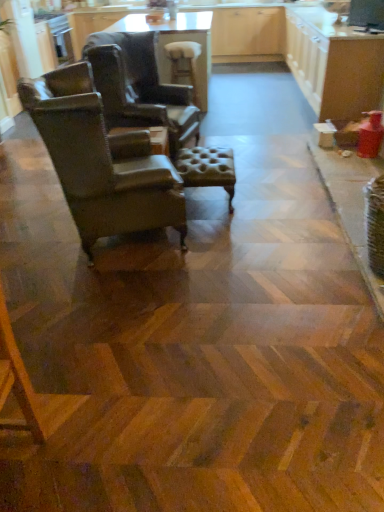
Question: Can you confirm if tufted leather ottoman at center, which ranks as the 1th bar stool in bottom-to-top order, is thinner than white glossy cabinets at upper right?

Choices:
 (A) yes
 (B) no

Answer: (A)

Question: From a real-world perspective, is tufted leather ottoman at center, which ranks as the 2th bar stool in back-to-front order, under white glossy cabinets at upper right?

Choices:
 (A) no
 (B) yes

Answer: (B)

Question: Is tufted leather ottoman at center, which ranks as the 1th bar stool in bottom-to-top order, positioned far away from white glossy cabinets at upper right?

Choices:
 (A) no
 (B) yes

Answer: (B)

Question: Is tufted leather ottoman at center, which ranks as the 2th bar stool in back-to-front order, directly adjacent to white glossy cabinets at upper right?

Choices:
 (A) no
 (B) yes

Answer: (A)

Question: Does tufted leather ottoman at center, which is the 1th bar stool in front-to-back order, have a lesser height compared to white glossy cabinets at upper right?

Choices:
 (A) yes
 (B) no

Answer: (A)

Question: From a real-world perspective, is tufted leather ottoman at center, the second bar stool viewed from the top, located higher than white glossy cabinets at upper right?

Choices:
 (A) no
 (B) yes

Answer: (A)

Question: Can you confirm if white glossy cabinets at upper right is smaller than brown leather chair at left, the first chair from the front?

Choices:
 (A) yes
 (B) no

Answer: (B)

Question: Is white glossy cabinets at upper right outside of brown leather chair at left, placed as the second chair when sorted from back to front?

Choices:
 (A) no
 (B) yes

Answer: (B)

Question: Considering the relative sizes of white glossy cabinets at upper right and brown leather chair at left, the first chair from the front, in the image provided, is white glossy cabinets at upper right thinner than brown leather chair at left, the first chair from the front,?

Choices:
 (A) no
 (B) yes

Answer: (B)

Question: From the image's perspective, is white glossy cabinets at upper right over brown leather chair at left, the first chair from the front?

Choices:
 (A) yes
 (B) no

Answer: (A)

Question: Is brown leather chair at left, placed as the second chair when sorted from back to front, inside white glossy cabinets at upper right?

Choices:
 (A) no
 (B) yes

Answer: (A)

Question: Can you confirm if white glossy cabinets at upper right is wider than brown leather chair at left, the first chair from the front?

Choices:
 (A) yes
 (B) no

Answer: (B)

Question: From the image's perspective, would you say leather wingback chair at left, the 1th chair from the back, is shown under white glossy cabinets at upper right?

Choices:
 (A) no
 (B) yes

Answer: (B)